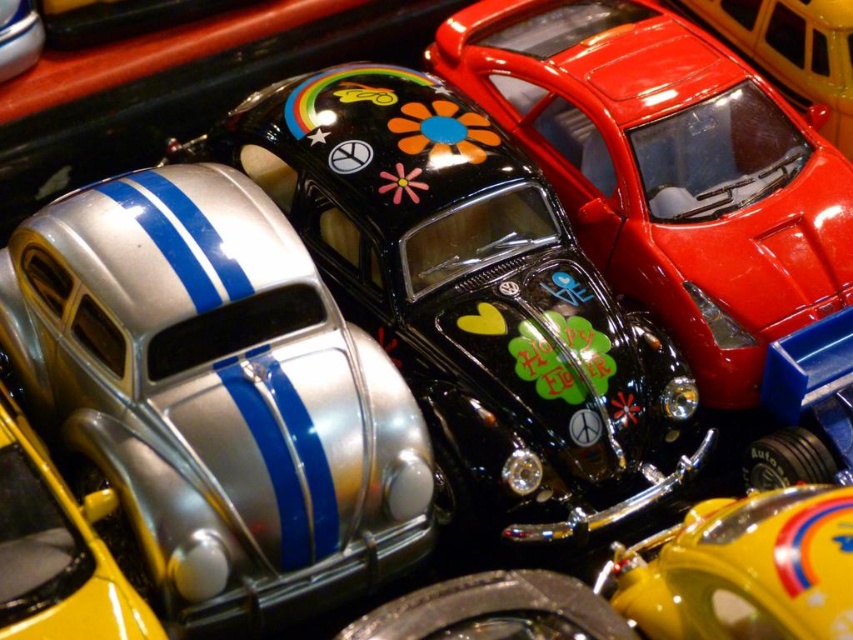
Question: Considering the real-world distances, which object is farthest from the glossy plastic car at upper center?

Choices:
 (A) silver metallic car at center-left
 (B) shiny chrome car at center
 (C) silver metallic car at left

Answer: (C)

Question: Is shiny chrome car at center to the left of glossy plastic car at upper center from the viewer's perspective?

Choices:
 (A) yes
 (B) no

Answer: (A)

Question: Is shiny chrome car at center wider than silver metallic car at lower left?

Choices:
 (A) no
 (B) yes

Answer: (B)

Question: Which point is farther to the camera?

Choices:
 (A) (219, 342)
 (B) (706, 612)

Answer: (A)

Question: Estimate the real-world distances between objects in this image. Which object is closer to the silver metallic car at lower left?

Choices:
 (A) silver metallic car at center-left
 (B) glossy plastic car at upper center
 (C) shiny chrome car at center

Answer: (C)

Question: From the image, what is the correct spatial relationship of silver metallic car at left in relation to silver metallic car at center-left?

Choices:
 (A) right
 (B) left

Answer: (B)